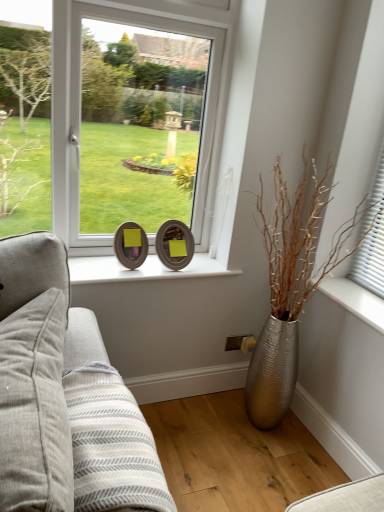
Question: Considering the positions of silver metallic vase at right and wooden oval frame at center, arranged as the second picture frame when viewed from the right, in the image, is silver metallic vase at right bigger or smaller than wooden oval frame at center, arranged as the second picture frame when viewed from the right,?

Choices:
 (A) big
 (B) small

Answer: (A)

Question: Choose the correct answer: Is silver metallic vase at right inside wooden oval frame at center, arranged as the second picture frame when viewed from the right, or outside it?

Choices:
 (A) inside
 (B) outside

Answer: (B)

Question: Considering the real-world distances, which object is farthest from the gray fabric pillow at left?

Choices:
 (A) silver metallic vase at right
 (B) wooden oval frame at center, arranged as the second picture frame when viewed from the right
 (C) wooden frame at center, which is counted as the first picture frame, starting from the right
 (D) silver metallic vase at right

Answer: (A)

Question: Estimate the real-world distances between objects in this image. Which object is closer to the silver metallic vase at right?

Choices:
 (A) silver metallic vase at right
 (B) wooden oval frame at center, arranged as the second picture frame when viewed from the right
 (C) gray fabric pillow at left
 (D) wooden frame at center, which is counted as the first picture frame, starting from the right

Answer: (A)